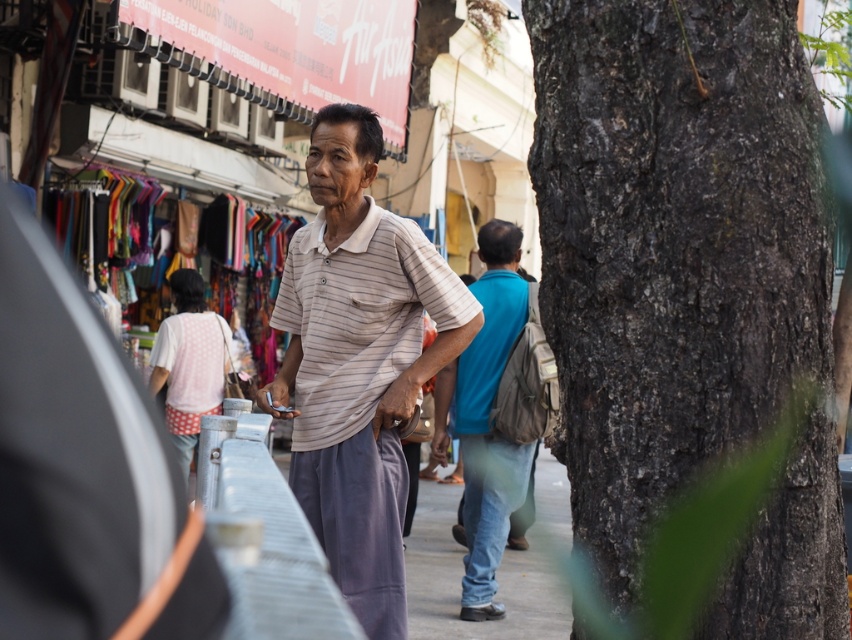
You are a pedestrian standing on the street and see the dark brown bark at right and the striped cotton shirt at center. Which object is higher from the ground?

The dark brown bark at right is located above the striped cotton shirt at center, so it is higher from the ground.